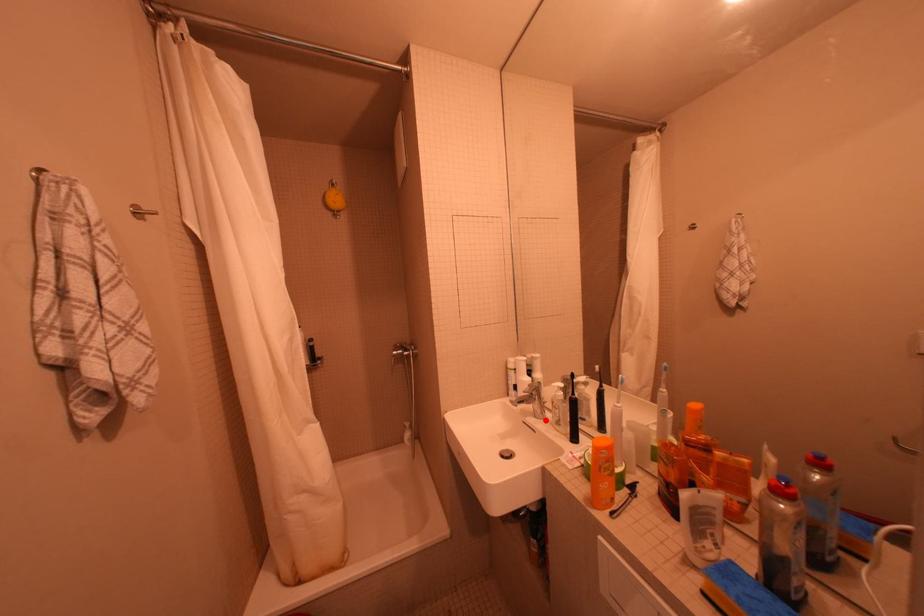
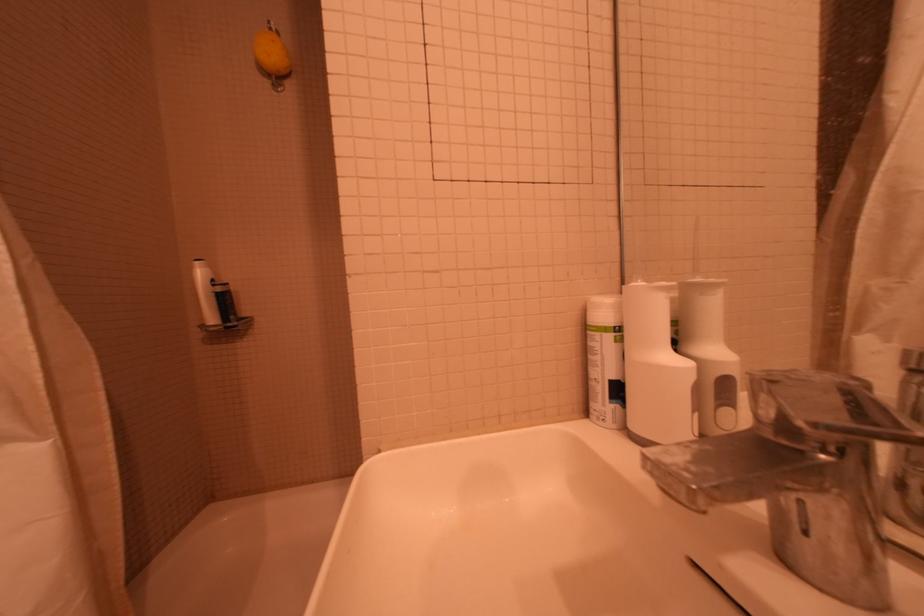
Locate, in the second image, the point that corresponds to the highlighted location in the first image.

(831, 592)